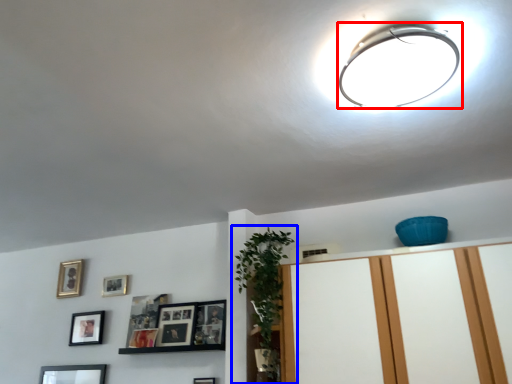
Question: Which object appears closest to the camera in this image, lamp (highlighted by a red box) or houseplant (highlighted by a blue box)?

Choices:
 (A) lamp
 (B) houseplant

Answer: (A)